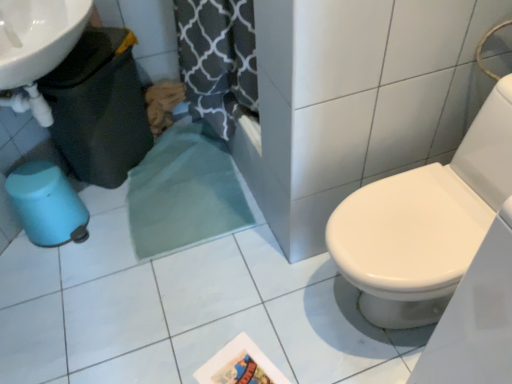
Question: Looking at their shapes, would you say matte black trash can at left, marked as the 1th potty in a top-to-bottom arrangement, is wider or thinner than matte plastic potty at lower left, which is the 1th potty from bottom to top?

Choices:
 (A) thin
 (B) wide

Answer: (A)

Question: Is point (90, 147) closer or farther from the camera than point (58, 168)?

Choices:
 (A) farther
 (B) closer

Answer: (A)

Question: Relative to matte plastic potty at lower left, which is the 1th potty from bottom to top, is matte black trash can at left, arranged as the 2th potty when ordered from the bottom, in front or behind?

Choices:
 (A) front
 (B) behind

Answer: (A)

Question: Is matte plastic potty at lower left, which is the 1th potty from bottom to top, spatially inside matte black trash can at left, marked as the 1th potty in a top-to-bottom arrangement, or outside of it?

Choices:
 (A) inside
 (B) outside

Answer: (B)

Question: Is matte plastic potty at lower left, placed as the 2th potty when sorted from top to bottom, in front of or behind matte black trash can at left, arranged as the 2th potty when ordered from the bottom, in the image?

Choices:
 (A) front
 (B) behind

Answer: (B)

Question: From a real-world perspective, is matte plastic potty at lower left, placed as the 2th potty when sorted from top to bottom, positioned above or below matte black trash can at left, arranged as the 2th potty when ordered from the bottom?

Choices:
 (A) below
 (B) above

Answer: (A)

Question: Considering the positions of point (41, 213) and point (91, 145), is point (41, 213) closer or farther from the camera than point (91, 145)?

Choices:
 (A) closer
 (B) farther

Answer: (A)